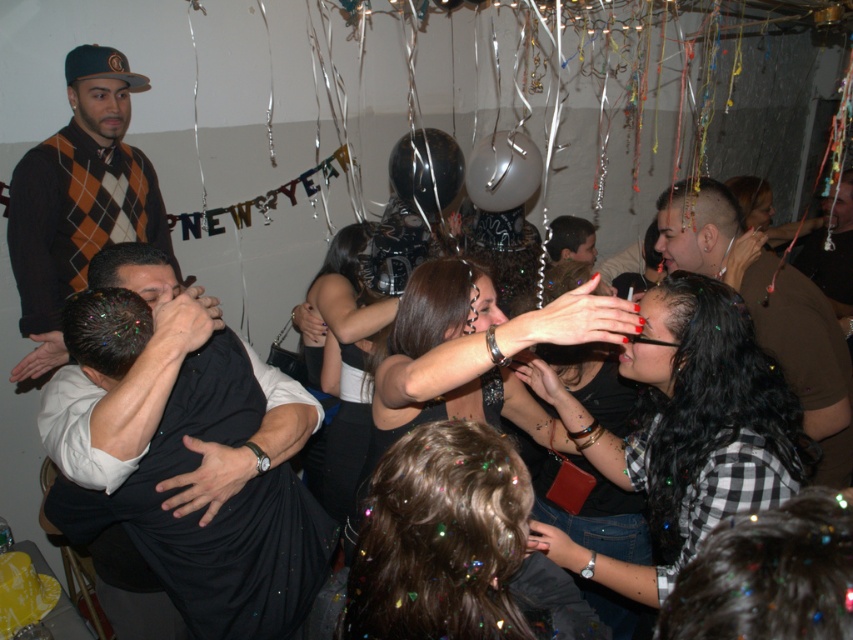
You are a photographer at the party and want to capture a photo that includes both the shiny brown leather jacket at right and the translucent plastic balloon at upper center. The camera you are using has a maximum focus range of 70 centimeters. Will you be able to include both objects in the same frame without moving the camera?

The shiny brown leather jacket at right and the translucent plastic balloon at upper center are 78.03 centimeters apart from each other. Since the distance between them exceeds the camera maximum focus range of 70 centimeters, you will not be able to include both objects in the same frame without moving the camera.

You are a photographer at the party and want to take a photo of the shiny brown leather jacket at right and the translucent plastic balloon at upper center. Since the balloon is smaller, will it appear smaller in the photo compared to the jacket?

The shiny brown leather jacket at right is larger in size than the translucent plastic balloon at upper center, so yes, the balloon will appear smaller in the photo compared to the jacket.